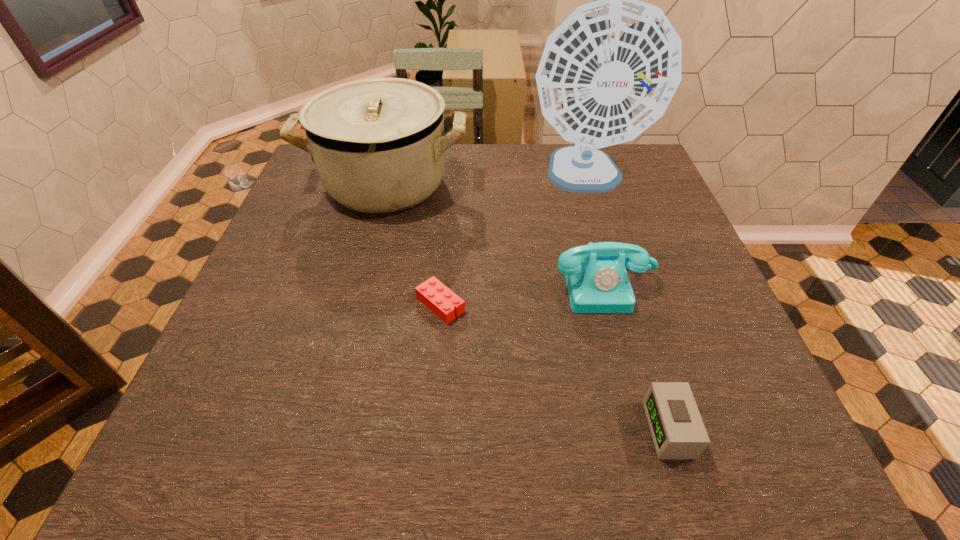
The image size is (960, 540). I want to click on empty location between the fourth shortest object and the telephone, so click(x=495, y=235).

Where is `vacant area between the telephone and the second shortest object`? The height and width of the screenshot is (540, 960). vacant area between the telephone and the second shortest object is located at coordinates (636, 357).

Identify the location of free area in between the Lego and the telephone. (522, 295).

What are the coordinates of `vacant area that lies between the Lego and the nearest object` in the screenshot? It's located at (555, 367).

Where is `vacant area that lies between the fan and the shortest object`? vacant area that lies between the fan and the shortest object is located at coordinates (513, 241).

At what (x,y) coordinates should I click in order to perform the action: click on free space between the third tallest object and the alarm clock. Please return your answer as a coordinate pair (x, y). The height and width of the screenshot is (540, 960). Looking at the image, I should click on (636, 357).

The width and height of the screenshot is (960, 540). Identify the location of free space that is in between the shortest object and the third tallest object. (522, 295).

Locate an element on the screen. The image size is (960, 540). object that is the second closest one to the telephone is located at coordinates (443, 302).

Select which object is the third closest to the telephone. Please provide its 2D coordinates. Your answer should be formatted as a tuple, i.e. [(x, y)], where the tuple contains the x and y coordinates of a point satisfying the conditions above.

[(678, 432)]